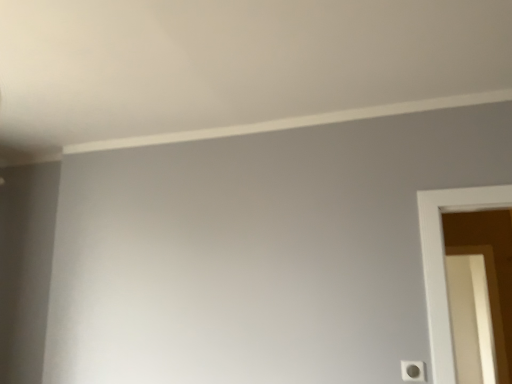
Question: Should I look upward or downward to see white glossy screen door at right?

Choices:
 (A) up
 (B) down

Answer: (B)

Question: Is white plastic light switch at lower right a part of white glossy screen door at right?

Choices:
 (A) no
 (B) yes

Answer: (A)

Question: Could you tell me if white glossy screen door at right is facing white plastic light switch at lower right?

Choices:
 (A) no
 (B) yes

Answer: (A)

Question: Is white glossy screen door at right not inside white plastic light switch at lower right?

Choices:
 (A) yes
 (B) no

Answer: (A)

Question: From the image's perspective, is white glossy screen door at right beneath white plastic light switch at lower right?

Choices:
 (A) no
 (B) yes

Answer: (B)

Question: From a real-world perspective, is white glossy screen door at right on white plastic light switch at lower right?

Choices:
 (A) no
 (B) yes

Answer: (B)

Question: From a real-world perspective, is white glossy screen door at right beneath white plastic light switch at lower right?

Choices:
 (A) yes
 (B) no

Answer: (B)

Question: Is the depth of white plastic light switch at lower right greater than that of white glossy screen door at right?

Choices:
 (A) no
 (B) yes

Answer: (A)

Question: Can you confirm if white plastic light switch at lower right is thinner than white glossy screen door at right?

Choices:
 (A) yes
 (B) no

Answer: (A)

Question: Considering the relative sizes of white plastic light switch at lower right and white glossy screen door at right in the image provided, is white plastic light switch at lower right wider than white glossy screen door at right?

Choices:
 (A) no
 (B) yes

Answer: (A)

Question: Can you confirm if white plastic light switch at lower right is positioned to the right of white glossy screen door at right?

Choices:
 (A) no
 (B) yes

Answer: (A)

Question: From a real-world perspective, is white plastic light switch at lower right below white glossy screen door at right?

Choices:
 (A) no
 (B) yes

Answer: (B)

Question: Is white plastic light switch at lower right at the left side of white glossy screen door at right?

Choices:
 (A) no
 (B) yes

Answer: (B)

Question: Is white plastic light switch at lower right in front of or behind white glossy screen door at right in the image?

Choices:
 (A) front
 (B) behind

Answer: (A)